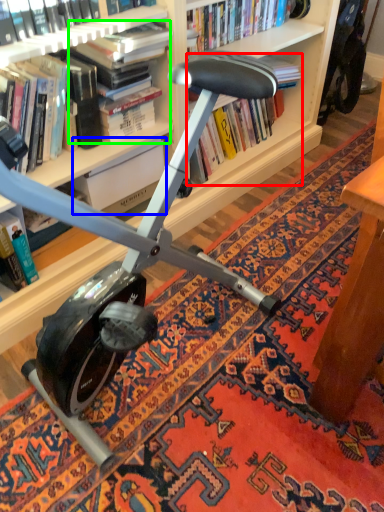
Question: Which object is positioned farthest from book (highlighted by a red box)? Select from paperback book (highlighted by a blue box) and book (highlighted by a green box).

Choices:
 (A) paperback book
 (B) book

Answer: (B)